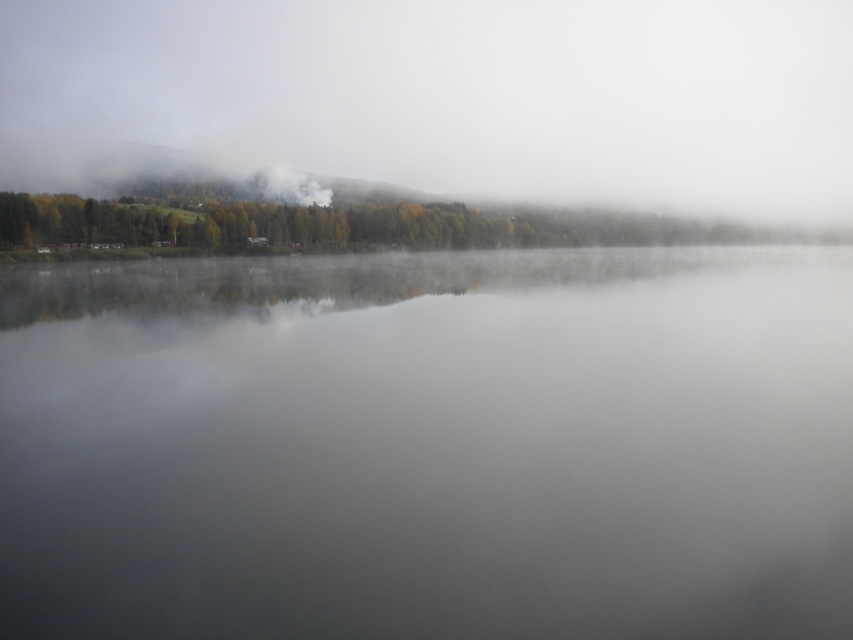
Question: Which object is farther from the camera taking this photo?

Choices:
 (A) white misty fog at upper center
 (B) green matte trees at upper center
 (C) transparent water at center

Answer: (A)

Question: Which is farther from the transparent water at center?

Choices:
 (A) white misty fog at upper center
 (B) green matte trees at upper center

Answer: (A)

Question: Is the position of transparent water at center less distant than that of white misty fog at upper center?

Choices:
 (A) yes
 (B) no

Answer: (A)

Question: Can you confirm if white misty fog at upper center is wider than green matte trees at upper center?

Choices:
 (A) no
 (B) yes

Answer: (B)

Question: Does transparent water at center appear over green matte trees at upper center?

Choices:
 (A) no
 (B) yes

Answer: (A)

Question: Which object appears closest to the camera in this image?

Choices:
 (A) green matte trees at upper center
 (B) transparent water at center

Answer: (B)